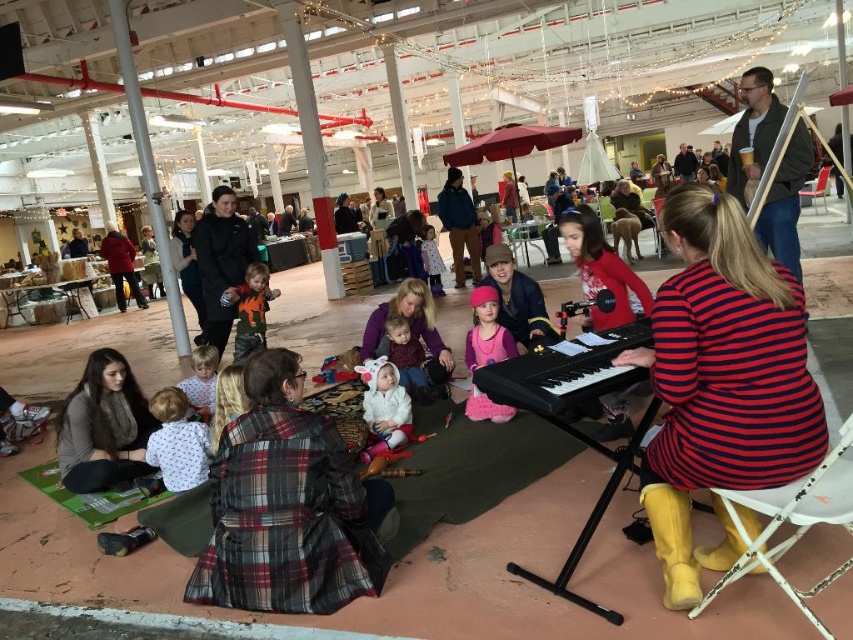
Is matte black jacket at center bigger than matte black jacket at upper left?

No, matte black jacket at center is not bigger than matte black jacket at upper left.

Is point (550, 337) positioned in front of point (115, 243)?

Yes, it is.

The image size is (853, 640). In order to click on matte black jacket at center in this screenshot , I will do `click(517, 300)`.

From the picture: Is white printed shirt at lower left smaller than pink fuzzy boots at center?

Yes.

Who is taller, white printed shirt at lower left or pink fuzzy boots at center?

Standing taller between the two is pink fuzzy boots at center.

Who is more distant from viewer, (167, 404) or (483, 321)?

Positioned behind is point (483, 321).

At what (x,y) coordinates should I click in order to perform the action: click on white printed shirt at lower left. Please return your answer as a coordinate pair (x, y). Looking at the image, I should click on (177, 442).

Is point (622, 396) positioned in front of point (120, 285)?

Yes, it is.

In order to click on matte red sweater at center in this screenshot , I will do `click(601, 269)`.

The image size is (853, 640). I want to click on matte red sweater at center, so click(x=601, y=269).